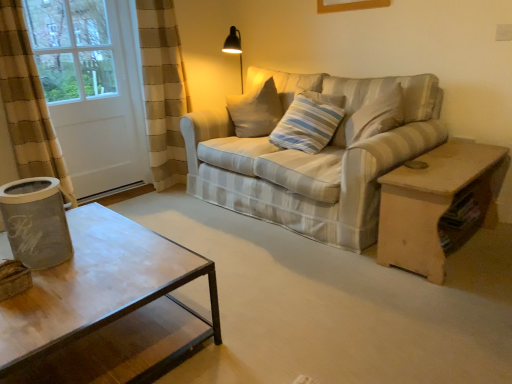
From a real-world perspective, point to a free spot above white matte screen door at left.

[(0.135, -0.000)]